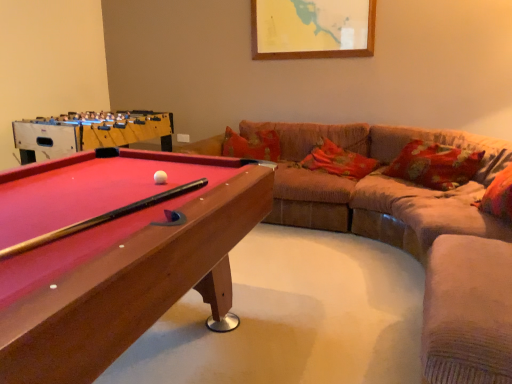
Question: From a real-world perspective, is suede-like beige swivel chair at lower right over velvet beige couch at right?

Choices:
 (A) yes
 (B) no

Answer: (B)

Question: Can you confirm if suede-like beige swivel chair at lower right is thinner than velvet beige couch at right?

Choices:
 (A) yes
 (B) no

Answer: (A)

Question: Considering the relative positions of suede-like beige swivel chair at lower right and velvet beige couch at right in the image provided, is suede-like beige swivel chair at lower right behind velvet beige couch at right?

Choices:
 (A) no
 (B) yes

Answer: (A)

Question: Is suede-like beige swivel chair at lower right next to velvet beige couch at right?

Choices:
 (A) yes
 (B) no

Answer: (B)

Question: Is the position of suede-like beige swivel chair at lower right less distant than that of velvet beige couch at right?

Choices:
 (A) no
 (B) yes

Answer: (B)

Question: From a real-world perspective, relative to floral fabric pillow at center, the third pillow in the front-to-back sequence, is smooth wood pool table at left vertically above or below?

Choices:
 (A) above
 (B) below

Answer: (A)

Question: Considering the positions of smooth wood pool table at left and floral fabric pillow at center, the third pillow in the front-to-back sequence, in the image, is smooth wood pool table at left bigger or smaller than floral fabric pillow at center, the third pillow in the front-to-back sequence,?

Choices:
 (A) big
 (B) small

Answer: (A)

Question: Visually, is smooth wood pool table at left positioned to the left or to the right of floral fabric pillow at center, the 1th pillow from the back?

Choices:
 (A) right
 (B) left

Answer: (B)

Question: Choose the correct answer: Is smooth wood pool table at left inside floral fabric pillow at center, the third pillow in the front-to-back sequence, or outside it?

Choices:
 (A) outside
 (B) inside

Answer: (A)

Question: Is fluffy fabric pillow at right, which is the 1th pillow from front to back, bigger or smaller than smooth wood pool table at left?

Choices:
 (A) big
 (B) small

Answer: (B)

Question: Considering the positions of fluffy fabric pillow at right, which is the 1th pillow from front to back, and smooth wood pool table at left in the image, is fluffy fabric pillow at right, which is the 1th pillow from front to back, wider or thinner than smooth wood pool table at left?

Choices:
 (A) wide
 (B) thin

Answer: (B)

Question: Considering the relative positions of fluffy fabric pillow at right, which is the 1th pillow from front to back, and smooth wood pool table at left in the image provided, is fluffy fabric pillow at right, which is the 1th pillow from front to back, to the left or to the right of smooth wood pool table at left?

Choices:
 (A) right
 (B) left

Answer: (A)

Question: From a real-world perspective, is fluffy fabric pillow at right, the third pillow in the back-to-front sequence, physically located above or below smooth wood pool table at left?

Choices:
 (A) below
 (B) above

Answer: (A)

Question: Is point 11,309 positioned closer to the camera than point 329,142?

Choices:
 (A) closer
 (B) farther

Answer: (A)

Question: Is wooden billiard table at left bigger or smaller than floral fabric pillow at center, the 1th pillow from the back?

Choices:
 (A) small
 (B) big

Answer: (B)